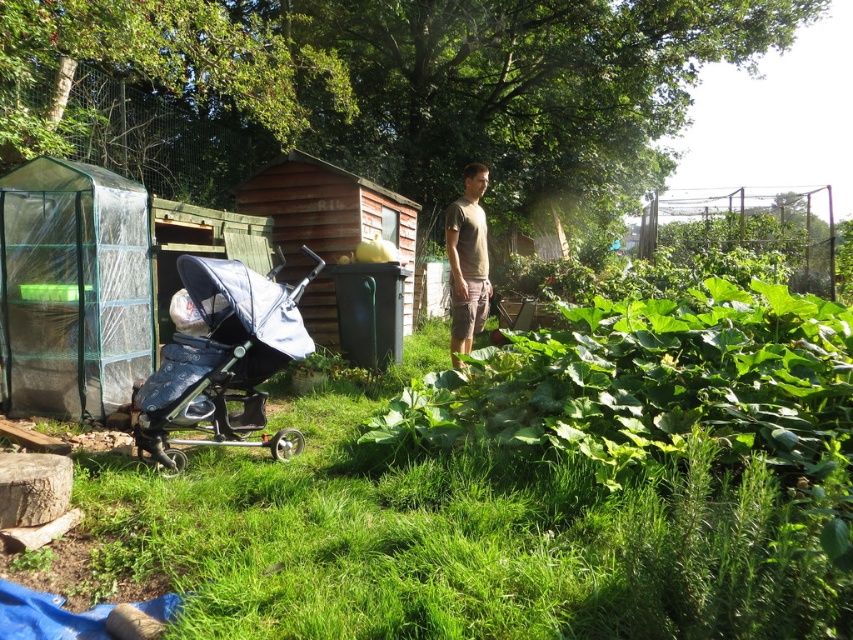
Who is shorter, blue fabric stroller at left or light brown cotton t-shirt at center?

Standing shorter between the two is blue fabric stroller at left.

Is blue fabric stroller at left smaller than light brown cotton t-shirt at center?

No, blue fabric stroller at left is not smaller than light brown cotton t-shirt at center.

Identify the location of blue fabric stroller at left. (223, 362).

At what (x,y) coordinates should I click in order to perform the action: click on blue fabric stroller at left. Please return your answer as a coordinate pair (x, y). The width and height of the screenshot is (853, 640). Looking at the image, I should click on (223, 362).

Can you confirm if wooden shed at center is positioned to the left of light brown cotton t-shirt at center?

Indeed, wooden shed at center is positioned on the left side of light brown cotton t-shirt at center.

Does wooden shed at center appear under light brown cotton t-shirt at center?

No.

Identify the location of wooden shed at center. (329, 216).

Who is shorter, blue fabric stroller at left or wooden shed at center?

blue fabric stroller at left is shorter.

Is point (216, 291) less distant than point (294, 253)?

Yes, it is in front of point (294, 253).

This screenshot has height=640, width=853. I want to click on blue fabric stroller at left, so click(x=223, y=362).